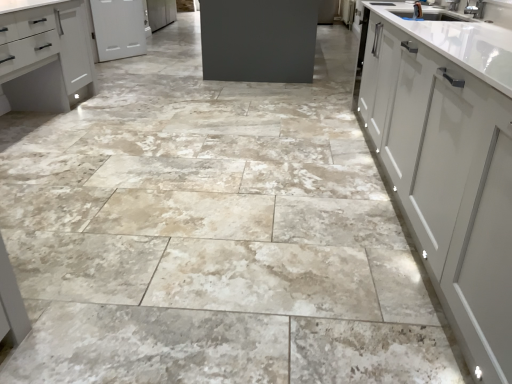
Image resolution: width=512 pixels, height=384 pixels. Identify the location of free point in front of white matte cabinet at upper left, arranged as the 1th cabinetry when viewed from the back. (122, 64).